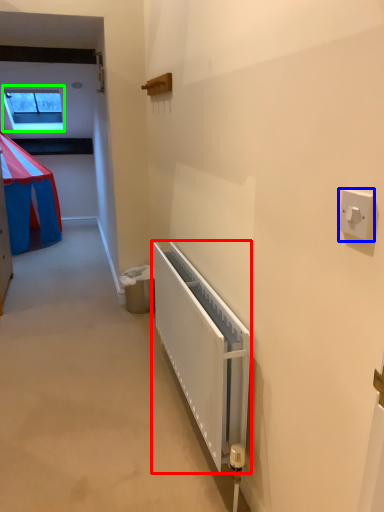
Question: Considering the real-world distances, which object is farthest from radiator (highlighted by a red box)? light switch (highlighted by a blue box) or window (highlighted by a green box)?

Choices:
 (A) light switch
 (B) window

Answer: (B)